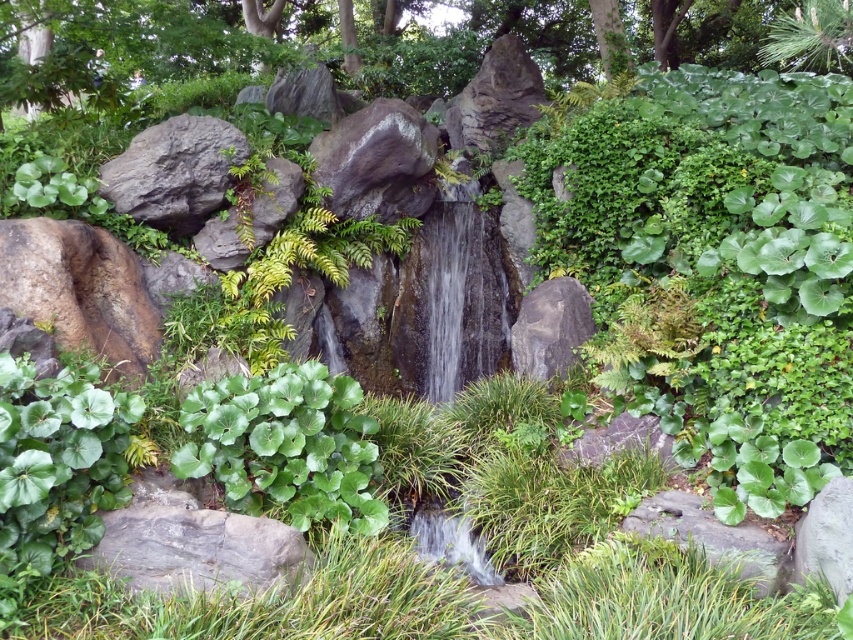
Based on the coordinates provided, where is the green leafy tree at upper center located in the image?

The green leafy tree at upper center is located at coordinates point (399, 38).

You are standing in the garden and notice the green leafy tree at upper center and the green matte leaf at center. Which object is positioned more to the left side of the garden?

The green leafy tree at upper center is positioned to the left of the green matte leaf at center, so it is more to the left side of the garden.

You are standing in the garden and want to place a 3.5 feet wide decorative statue between the gray rough rock at lower left and yourself. Is there enough space?

The distance between the gray rough rock at lower left and the viewer is 9.46 feet. Since the statue is 3.5 feet wide, there is sufficient space as 9.46 feet is greater than 3.5 feet.